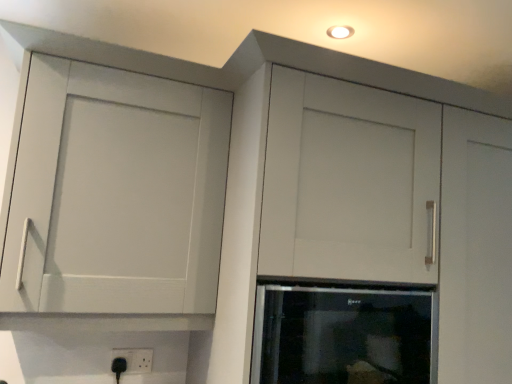
Question: Is black plastic electric outlet at lower center spatially inside black glass oven at center, or outside of it?

Choices:
 (A) inside
 (B) outside

Answer: (B)

Question: Is black plastic electric outlet at lower center in front of or behind black glass oven at center in the image?

Choices:
 (A) front
 (B) behind

Answer: (B)

Question: Based on their relative distances, which object is farther from the matte white cupboard at upper left?

Choices:
 (A) black glass oven at center
 (B) black plastic electric outlet at lower center

Answer: (B)

Question: Which is nearer to the matte white cupboard at upper left?

Choices:
 (A) black plastic electric outlet at lower center
 (B) black glass oven at center

Answer: (B)